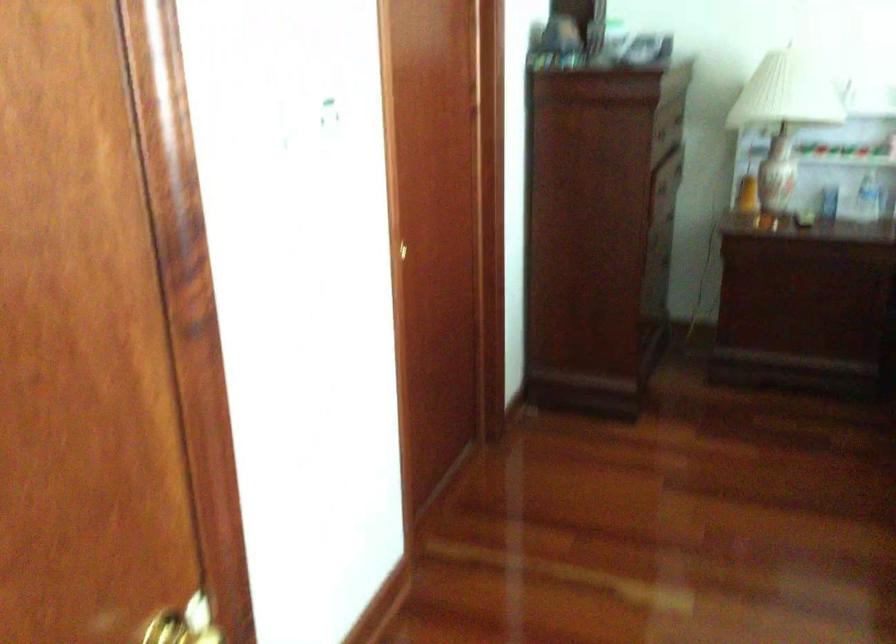
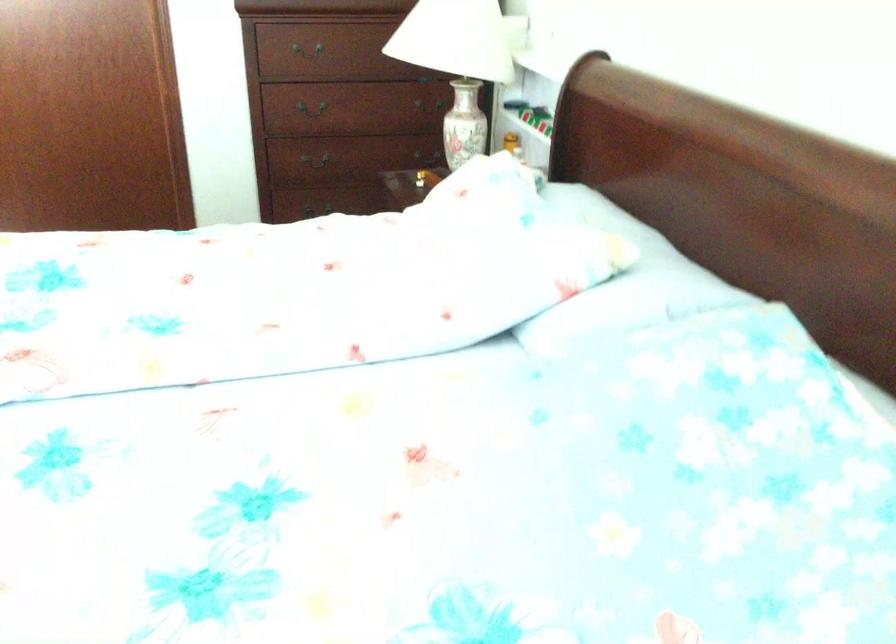
In the second image, find the point that corresponds to point (599, 247) in the first image.

(323, 158)